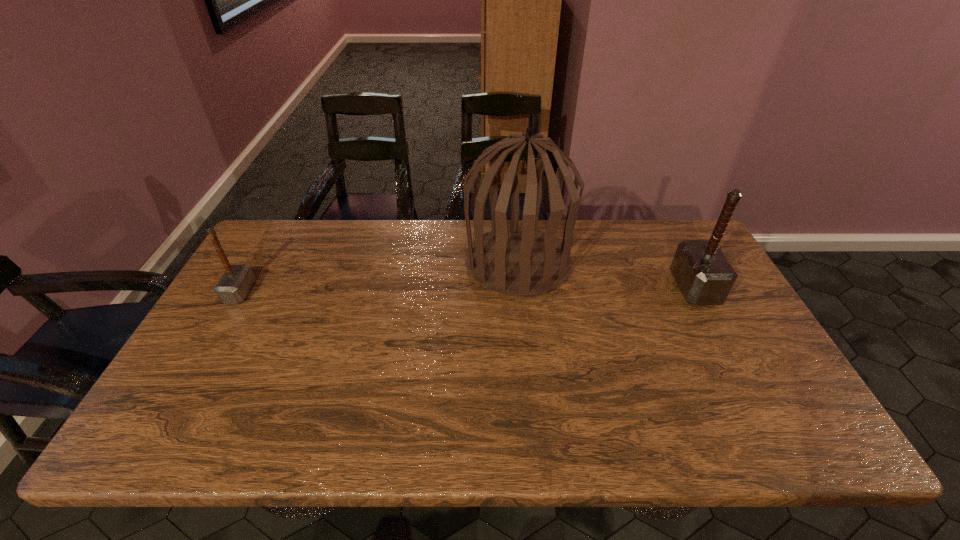
In order to click on the second object from right to left in this screenshot , I will do (x=514, y=261).

Where is `the tallest object`? The height and width of the screenshot is (540, 960). the tallest object is located at coordinates (514, 261).

Locate an element on the screen. the right hammer is located at coordinates [704, 275].

Where is `the rightmost object`? the rightmost object is located at coordinates (704, 275).

The width and height of the screenshot is (960, 540). I want to click on the shortest object, so click(233, 287).

Where is `the leftmost object`? the leftmost object is located at coordinates (233, 287).

The width and height of the screenshot is (960, 540). I want to click on blank space located on the left of the second object from left to right, so click(443, 263).

What are the coordinates of `vacant point located 0.160m on the left of the taller hammer` in the screenshot? It's located at (622, 288).

The image size is (960, 540). I want to click on vacant space located on the striking surface of the leftmost object, so click(x=281, y=292).

Where is `object present at the far edge`? object present at the far edge is located at coordinates (514, 261).